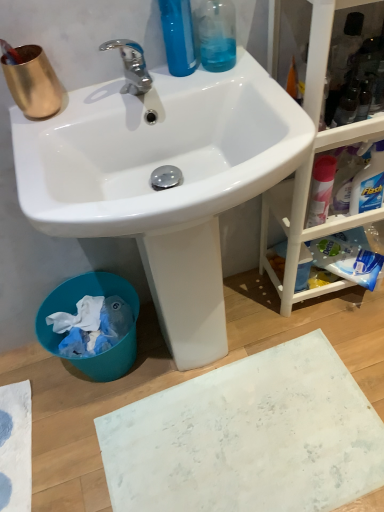
Question: Is white glossy sink at upper center surrounding transparent plastic bottle at upper center?

Choices:
 (A) no
 (B) yes

Answer: (A)

Question: From a real-world perspective, is white glossy sink at upper center positioned under transparent plastic bottle at upper center based on gravity?

Choices:
 (A) yes
 (B) no

Answer: (A)

Question: Could you tell me if white glossy sink at upper center is facing transparent plastic bottle at upper center?

Choices:
 (A) no
 (B) yes

Answer: (A)

Question: From the image's perspective, does white glossy sink at upper center appear lower than transparent plastic bottle at upper center?

Choices:
 (A) yes
 (B) no

Answer: (A)

Question: Does white glossy sink at upper center have a smaller size compared to transparent plastic bottle at upper center?

Choices:
 (A) yes
 (B) no

Answer: (B)

Question: Does white glossy sink at upper center appear on the left side of transparent plastic bottle at upper center?

Choices:
 (A) no
 (B) yes

Answer: (B)

Question: Is chrome metallic faucet at upper center bigger than blue plastic trash bin at lower left?

Choices:
 (A) yes
 (B) no

Answer: (B)

Question: Is chrome metallic faucet at upper center in front of blue plastic trash bin at lower left?

Choices:
 (A) no
 (B) yes

Answer: (B)

Question: Is chrome metallic faucet at upper center not near blue plastic trash bin at lower left?

Choices:
 (A) yes
 (B) no

Answer: (B)

Question: Is chrome metallic faucet at upper center smaller than blue plastic trash bin at lower left?

Choices:
 (A) no
 (B) yes

Answer: (B)

Question: From a real-world perspective, is chrome metallic faucet at upper center below blue plastic trash bin at lower left?

Choices:
 (A) no
 (B) yes

Answer: (A)

Question: Would you say chrome metallic faucet at upper center contains blue plastic trash bin at lower left?

Choices:
 (A) yes
 (B) no

Answer: (B)

Question: Does white matte bath mat at lower center lie in front of white glossy sink at upper center?

Choices:
 (A) yes
 (B) no

Answer: (B)